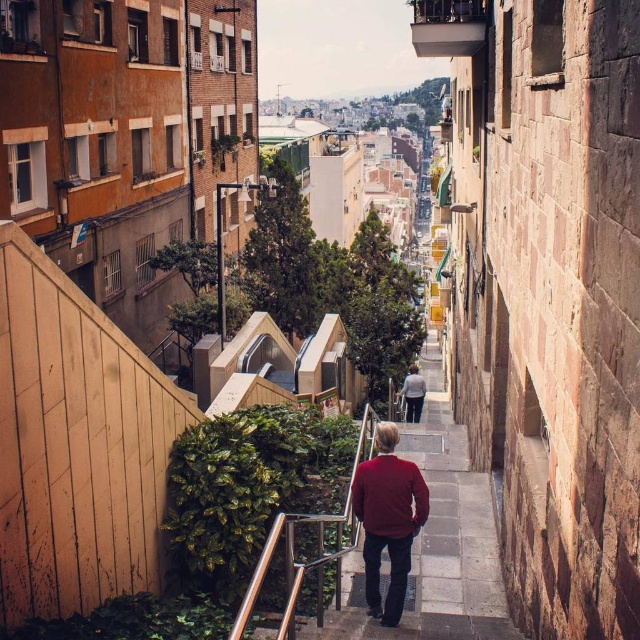
You are standing at the bottom of the staircase and see two people wearing jackets. The first is wearing a matte red sweater at center and the second is wearing a light blue denim jacket at center. Which person is closer to the wooden fence on the left side?

The matte red sweater at center is to the left of light blue denim jacket at center, so the person wearing the matte red sweater at center is closer to the wooden fence on the left side.

You are standing at the bottom of the staircase and see the point marked at coordinates (387,518). What object is located at that point?

The point at coordinates (387,518) corresponds to the matte red sweater at center.

You are standing at the bottom of the staircase and see two people wearing the matte red sweater at center and the light blue denim jacket at center. Which person is taller?

The matte red sweater at center is taller than the light blue denim jacket at center, so the person wearing the matte red sweater at center is taller.